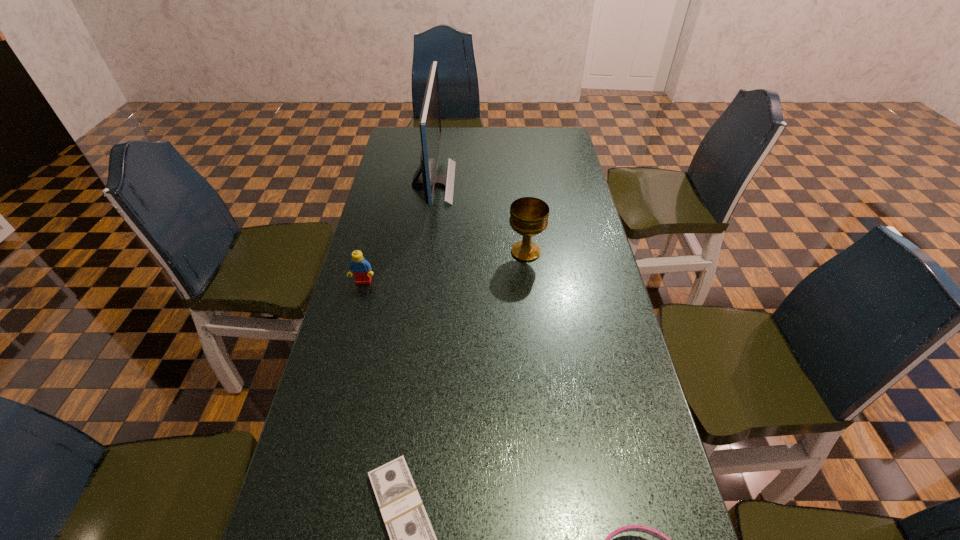
Identify the location of monitor at the left edge. (430, 118).

What are the coordinates of `Lego located in the left edge section of the desktop` in the screenshot? It's located at (361, 268).

Locate an element on the screen. Image resolution: width=960 pixels, height=540 pixels. object that is at the far left corner is located at coordinates (430, 118).

The image size is (960, 540). I want to click on vacant position at the left edge of the desktop, so click(375, 277).

The image size is (960, 540). In the image, there is a desktop. Identify the location of vacant space at the right edge. (572, 228).

In the image, there is a desktop. In order to click on vacant space at the far left corner in this screenshot , I will do `click(396, 140)`.

Locate an element on the screen. Image resolution: width=960 pixels, height=540 pixels. free space between the monitor and the fourth nearest object is located at coordinates (479, 217).

Find the location of `vacant space that's between the second tallest object and the third nearest object`. vacant space that's between the second tallest object and the third nearest object is located at coordinates (444, 267).

Identify the location of object that is the closest to the farthest object. (529, 216).

What are the coordinates of `object that is the nearest to the dollar` in the screenshot? It's located at (663, 539).